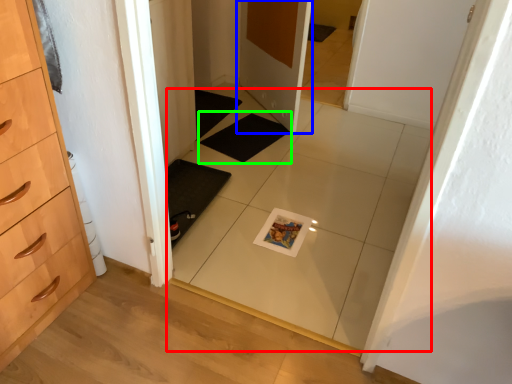
Question: Estimate the real-world distances between objects in this image. Which object is farther from tile (highlighted by a red box), door (highlighted by a blue box) or bath mat (highlighted by a green box)?

Choices:
 (A) door
 (B) bath mat

Answer: (A)